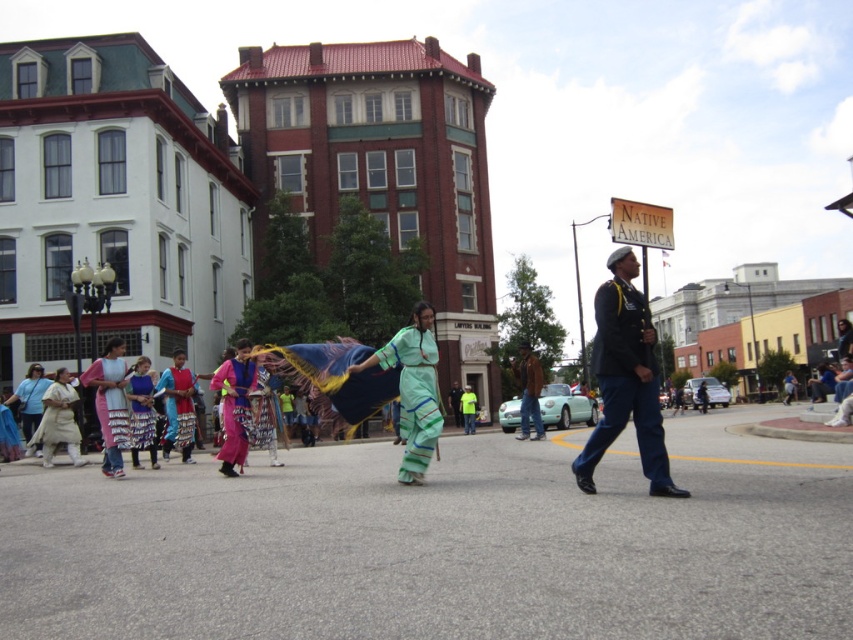
You are standing at the center of the street in the lively parade scene. There are two points marked on the ground ahead of you. The first point is at coordinates point (x=97, y=376), and the second point is at point (x=44, y=380). Which of these two points is closer to you?

Point (x=97, y=376) is in front of point (x=44, y=380), so the closer point to you is point (x=97, y=376).

You are standing in the middle of the lively street scene and want to take a photo. There are two points marked in the image, point 1 at coordinates point [415,362] and point 2 at coordinates point [527,348]. Which point is closer to you?

Point [415,362] is closer to the viewer than point [527,348].

You are a photographer trying to capture both the white cotton dress at left and the matte green dress at lower left in a single frame. Given their positions and sizes, which dress will appear smaller in the photo?

The white cotton dress at left will appear smaller in the photo because it has a lesser width compared to the matte green dress at lower left.